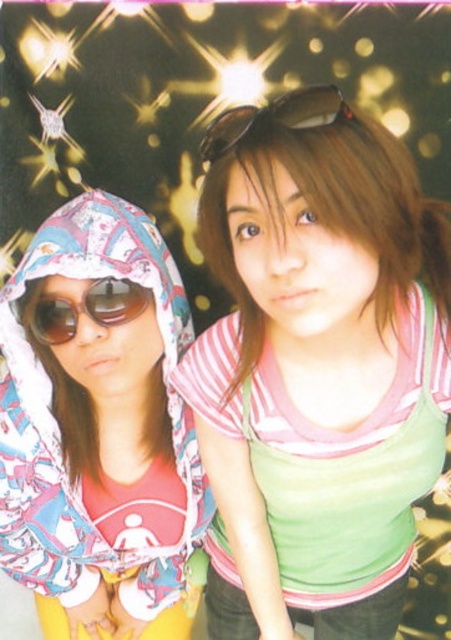
You are trying to locate the green fabric tank top at center in the image. According to the coordinates provided, where exactly is it positioned?

The green fabric tank top at center is located at point (317, 368).

You are a photographer trying to capture a closeup shot of the sunglasses at left without the green fabric tank top at center appearing in the frame. Is it possible to do so based on their sizes?

The green fabric tank top at center has a larger size compared to sunglasses at left, so it might be challenging to frame the sunglasses at left without including the green fabric tank top at center due to its larger size.